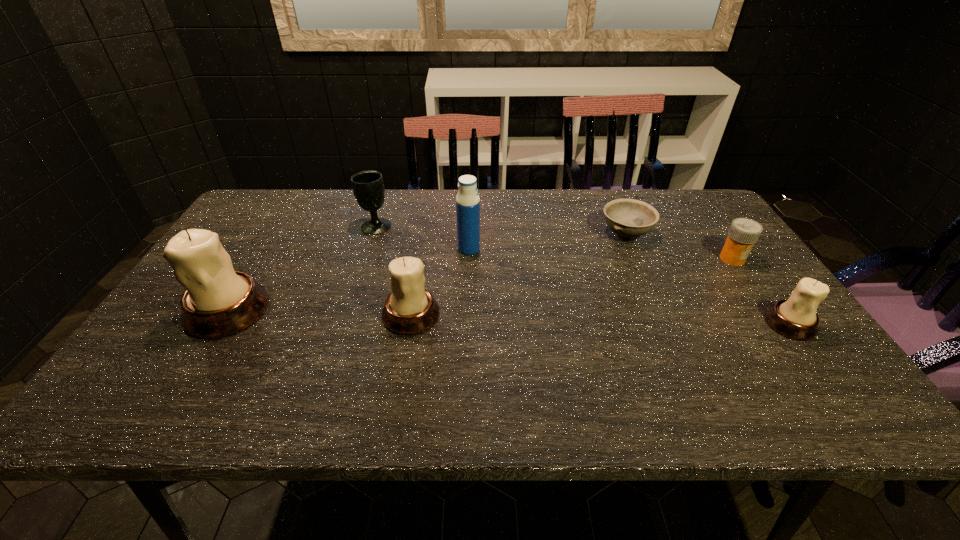
Please mark a free spot for a new candle_holder to balance the arrangement. Please provide its 2D coordinates. Your answer should be formatted as a tuple, i.e. [(x, y)], where the tuple contains the x and y coordinates of a point satisfying the conditions above.

[(599, 319)]